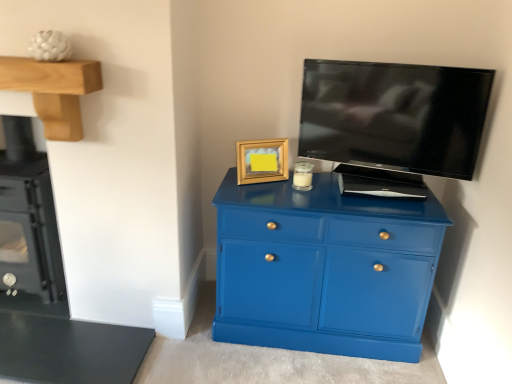
Question: Is black glass stove at left positioned far away from gold wooden picture frame at upper center?

Choices:
 (A) no
 (B) yes

Answer: (B)

Question: Could you tell me if black glass stove at left is facing gold wooden picture frame at upper center?

Choices:
 (A) no
 (B) yes

Answer: (A)

Question: Can we say black glass stove at left lies outside gold wooden picture frame at upper center?

Choices:
 (A) yes
 (B) no

Answer: (A)

Question: Can you confirm if black glass stove at left is positioned to the left of gold wooden picture frame at upper center?

Choices:
 (A) yes
 (B) no

Answer: (A)

Question: Is black glass stove at left with gold wooden picture frame at upper center?

Choices:
 (A) no
 (B) yes

Answer: (A)

Question: From a real-world perspective, relative to glossy blue cabinet at center, is black glossy tv at upper right vertically above or below?

Choices:
 (A) above
 (B) below

Answer: (A)

Question: Is black glossy tv at upper right taller or shorter than glossy blue cabinet at center?

Choices:
 (A) short
 (B) tall

Answer: (A)

Question: Considering the positions of black glossy tv at upper right and glossy blue cabinet at center in the image, is black glossy tv at upper right wider or thinner than glossy blue cabinet at center?

Choices:
 (A) wide
 (B) thin

Answer: (B)

Question: Considering the positions of point (409, 74) and point (250, 274), is point (409, 74) closer or farther from the camera than point (250, 274)?

Choices:
 (A) closer
 (B) farther

Answer: (A)

Question: From the image's perspective, is glossy blue cabinet at center above or below black glossy tv at upper right?

Choices:
 (A) below
 (B) above

Answer: (A)

Question: Is glossy blue cabinet at center spatially inside black glossy tv at upper right, or outside of it?

Choices:
 (A) outside
 (B) inside

Answer: (A)

Question: Is glossy blue cabinet at center wider or thinner than black glossy tv at upper right?

Choices:
 (A) wide
 (B) thin

Answer: (A)

Question: Is point (330, 337) closer or farther from the camera than point (437, 89)?

Choices:
 (A) closer
 (B) farther

Answer: (B)

Question: In terms of size, does black glass stove at left appear bigger or smaller than black glossy tv at upper right?

Choices:
 (A) small
 (B) big

Answer: (B)

Question: From the image's perspective, is black glass stove at left positioned above or below black glossy tv at upper right?

Choices:
 (A) below
 (B) above

Answer: (A)